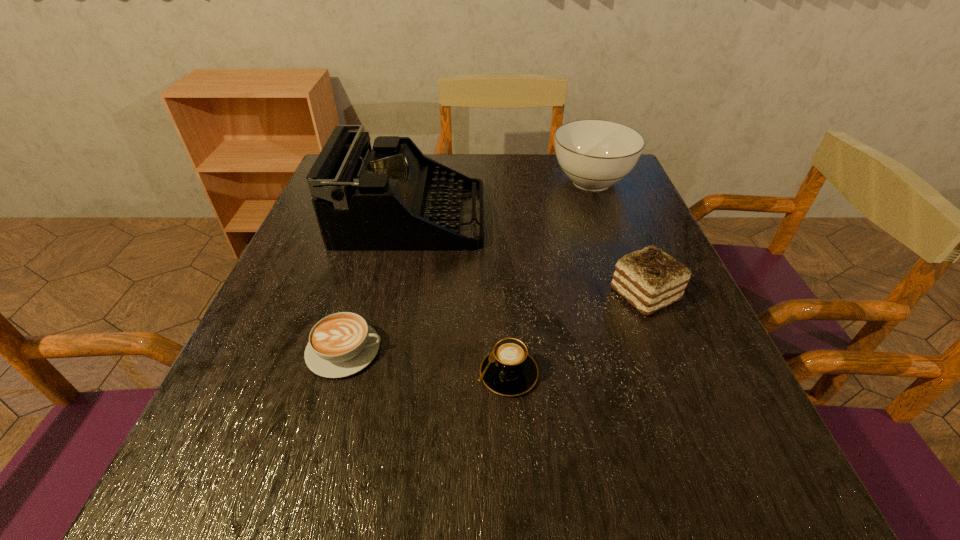
Find the location of a particular element. the tallest object is located at coordinates (390, 197).

What are the coordinates of `the second tallest object` in the screenshot? It's located at (594, 154).

Where is `the third shortest object`? This screenshot has height=540, width=960. the third shortest object is located at coordinates (649, 279).

Locate an element on the screen. The image size is (960, 540). the third farthest object is located at coordinates (649, 279).

I want to click on the right cappuccino, so click(508, 370).

Where is `the fourth tallest object`? the fourth tallest object is located at coordinates (508, 370).

At what (x,y) coordinates should I click in order to perform the action: click on the shortest object. Please return your answer as a coordinate pair (x, y). Looking at the image, I should click on (341, 344).

Identify the location of the shorter cappuccino. (341, 344).

Where is `vacant space situated on the typing side of the typewriter`? The height and width of the screenshot is (540, 960). vacant space situated on the typing side of the typewriter is located at coordinates (636, 218).

Where is `vacant region located on the front of the chinaware`? The height and width of the screenshot is (540, 960). vacant region located on the front of the chinaware is located at coordinates (631, 288).